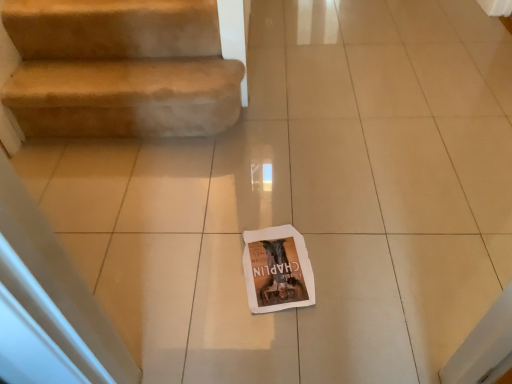
Find the location of `free space to the right of white paper at center`. free space to the right of white paper at center is located at coordinates (356, 280).